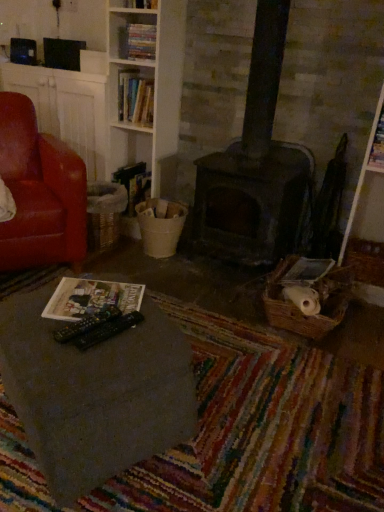
Question: From a real-world perspective, is dark gray stone fireplace at center physically located above or below leather at left?

Choices:
 (A) above
 (B) below

Answer: (B)

Question: Relative to leather at left, is dark gray stone fireplace at center in front or behind?

Choices:
 (A) front
 (B) behind

Answer: (B)

Question: Considering the real-world distances, which object is farthest from the matte paper magazine at lower left, positioned as the second magazine in top-to-bottom order?

Choices:
 (A) hardcover book at center, placed as the 1th book when sorted from bottom to top
 (B) dark gray stone fireplace at center
 (C) hardcover book at upper center, which is the second book in top-to-bottom order
 (D) smooth gray table at lower left
 (E) hardcover books at upper center, positioned as the 1th book in top-to-bottom order

Answer: (E)

Question: Estimate the real-world distances between objects in this image. Which object is closer to the smooth gray table at lower left?

Choices:
 (A) matte paper magazine at lower left, which ranks as the second magazine in back-to-front order
 (B) hardcover book at upper center, the second book in the bottom-to-top sequence
 (C) leather at left
 (D) matte paper magazine at upper right, the 1th magazine in the right-to-left sequence
 (E) hardcover books at upper center, the 3th book positioned from the bottom

Answer: (A)